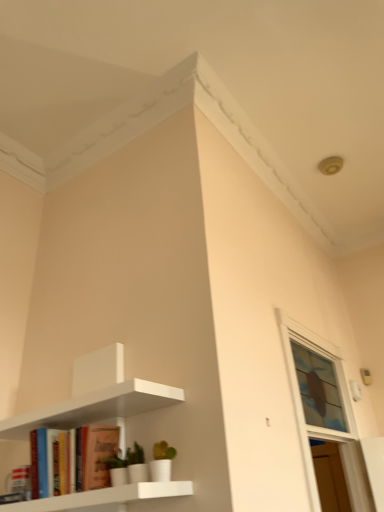
Question: From a real-world perspective, is matte orange book at lower left located beneath clear glass window at upper right?

Choices:
 (A) yes
 (B) no

Answer: (A)

Question: Is matte orange book at lower left smaller than clear glass window at upper right?

Choices:
 (A) yes
 (B) no

Answer: (A)

Question: Considering the relative sizes of matte orange book at lower left and clear glass window at upper right in the image provided, is matte orange book at lower left wider than clear glass window at upper right?

Choices:
 (A) no
 (B) yes

Answer: (A)

Question: Is matte orange book at lower left positioned with its back to clear glass window at upper right?

Choices:
 (A) yes
 (B) no

Answer: (A)

Question: Is there a large distance between matte orange book at lower left and clear glass window at upper right?

Choices:
 (A) yes
 (B) no

Answer: (A)

Question: Is matte orange book at lower left aimed at clear glass window at upper right?

Choices:
 (A) no
 (B) yes

Answer: (A)

Question: Is matte orange book at lower left wider than white matte shelf at upper left?

Choices:
 (A) yes
 (B) no

Answer: (B)

Question: From the image's perspective, is matte orange book at lower left below white matte shelf at upper left?

Choices:
 (A) no
 (B) yes

Answer: (B)

Question: Considering the relative sizes of matte orange book at lower left and white matte shelf at upper left in the image provided, is matte orange book at lower left shorter than white matte shelf at upper left?

Choices:
 (A) yes
 (B) no

Answer: (A)

Question: Is matte orange book at lower left positioned with its back to white matte shelf at upper left?

Choices:
 (A) yes
 (B) no

Answer: (A)

Question: Is matte orange book at lower left outside of white matte shelf at upper left?

Choices:
 (A) no
 (B) yes

Answer: (A)

Question: Is matte orange book at lower left positioned behind white matte shelf at upper left?

Choices:
 (A) yes
 (B) no

Answer: (A)

Question: From the image's perspective, would you say white matte shelf at upper left is positioned over clear glass window at upper right?

Choices:
 (A) yes
 (B) no

Answer: (A)